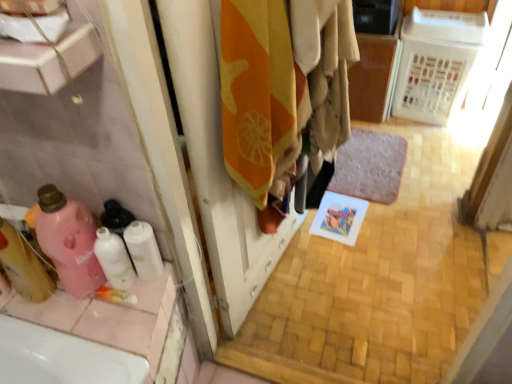
At what (x,y) coordinates should I click in order to perform the action: click on vacant area that is in front of gray plush bath mat at center. Please return your answer as a coordinate pair (x, y). Looking at the image, I should click on (399, 221).